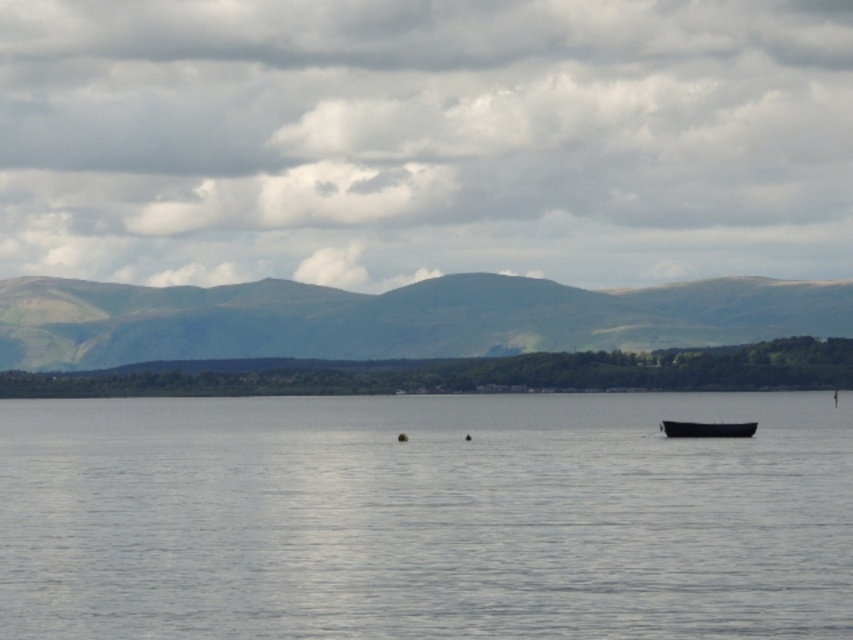
You are a hiker standing at the point with coordinates [395,317] in the image. Which landmark would you be standing on?

You are standing on the green grassy mountain at center, as it is located at point [395,317].

You are a hiker planning to take a photo of the smooth gray water at center and the green grassy mountain at center. Which object should you focus on first if you want to capture both in a single frame without moving the camera?

You should focus on the green grassy mountain at center first because it is larger and closer to the camera than the smooth gray water at center, ensuring both are in focus when using depth of field techniques.